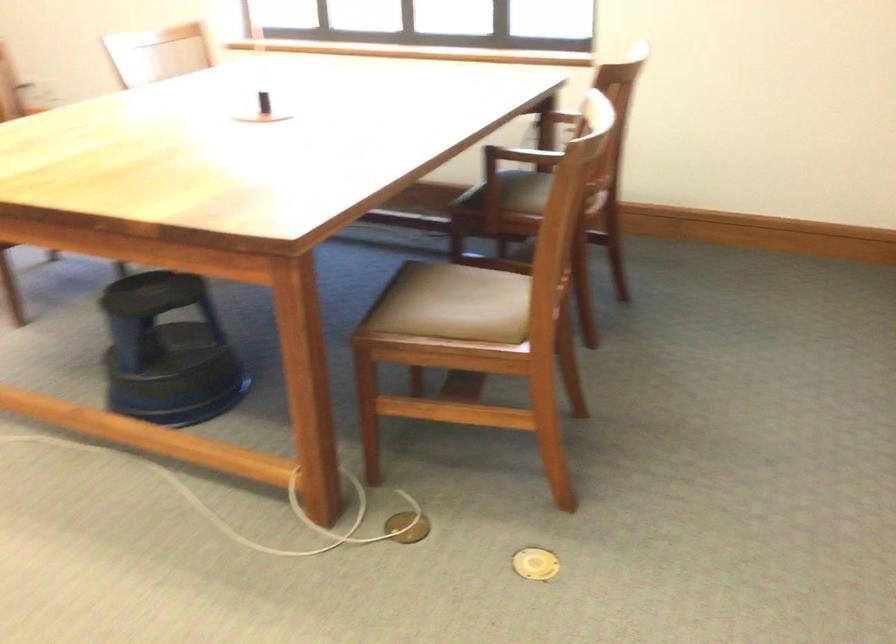
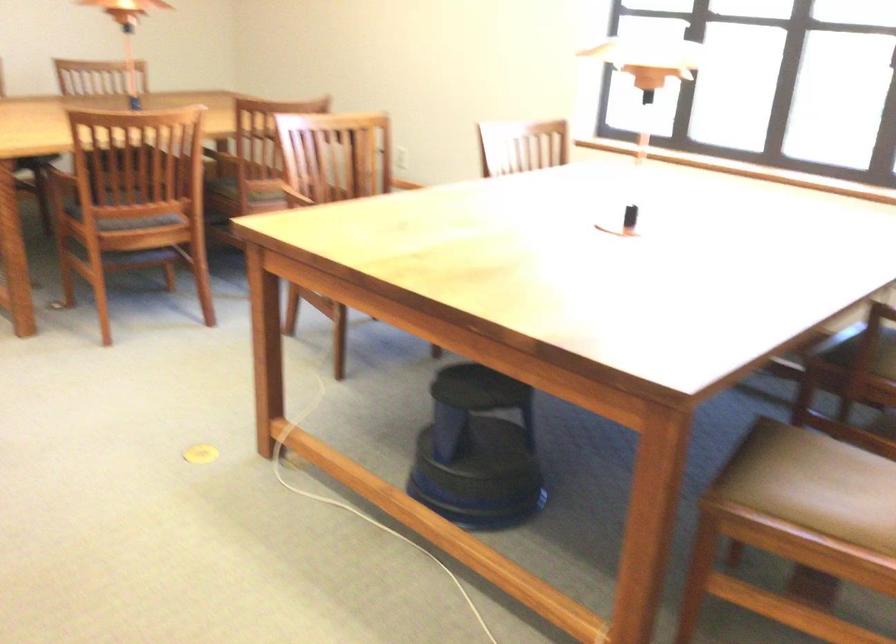
The point at (478, 190) is marked in the first image. Where is the corresponding point in the second image?

(851, 346)